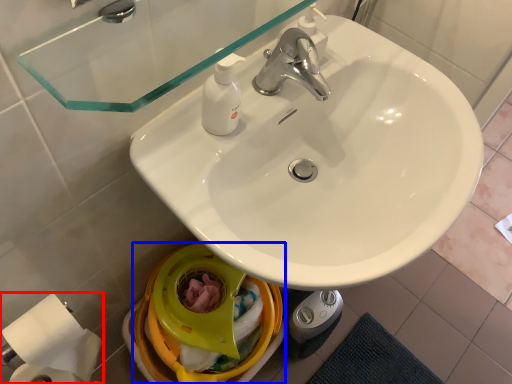
Question: Which of the following is the farthest to the observer, toilet paper (highlighted by a red box) or bidet (highlighted by a blue box)?

Choices:
 (A) toilet paper
 (B) bidet

Answer: (B)